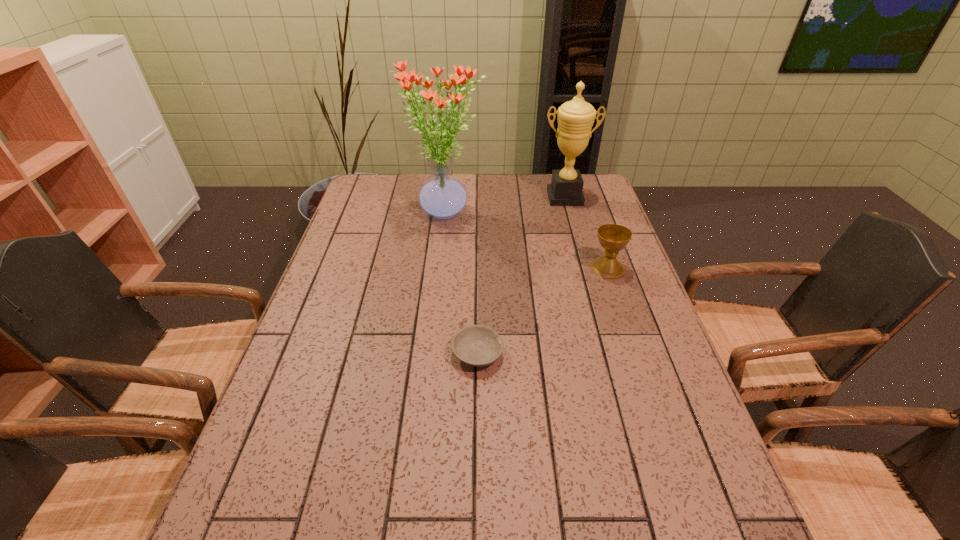
The width and height of the screenshot is (960, 540). What are the coordinates of `flower arrangement at the far edge` in the screenshot? It's located at (443, 197).

Identify the location of trophy cup that is at the far edge. (576, 117).

This screenshot has width=960, height=540. I want to click on trophy cup that is at the right edge, so click(x=576, y=117).

Locate an element on the screen. This screenshot has height=540, width=960. chalice located in the right edge section of the desktop is located at coordinates (613, 237).

Where is `object present at the far right corner`? object present at the far right corner is located at coordinates (576, 117).

In the image, there is a desktop. Where is `vacant region at the far edge`? Image resolution: width=960 pixels, height=540 pixels. vacant region at the far edge is located at coordinates (526, 200).

Locate an element on the screen. Image resolution: width=960 pixels, height=540 pixels. free space at the left edge is located at coordinates (x=383, y=251).

Identify the location of free space at the right edge. Image resolution: width=960 pixels, height=540 pixels. (680, 518).

Find the location of `vacant space at the far right corner of the desktop`. vacant space at the far right corner of the desktop is located at coordinates (599, 195).

Locate an element on the screen. Image resolution: width=960 pixels, height=540 pixels. empty location between the chalice and the shortest object is located at coordinates (542, 310).